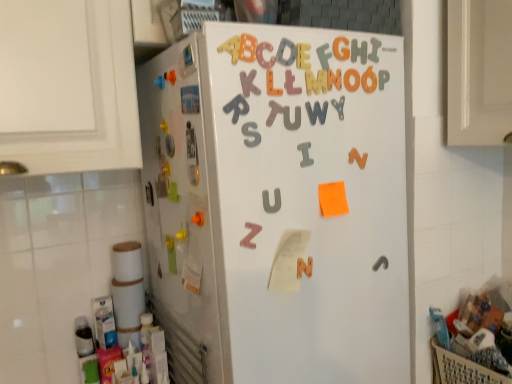
Question: Is rubberized plastic letter f at upper center, placed as the 7th letter when sorted from left to right, situated inside matte plastic letter t at center, which is the ninth letter from right to left, or outside?

Choices:
 (A) inside
 (B) outside

Answer: (B)

Question: Is point (326, 66) positioned closer to the camera than point (275, 112)?

Choices:
 (A) farther
 (B) closer

Answer: (A)

Question: Which object is the closest to the matte plastic letter t at center, which is the ninth letter from right to left?

Choices:
 (A) plastic beige basket at lower right
 (B) rubberized plastic letter f at upper center, placed as the 7th letter when sorted from left to right
 (C) orange matte letter n at upper center, which is the 8th letter from left to right
 (D) gray matte letter w at upper center, which is the 4th letter in right-to-left order
 (E) yellow foam letter e at upper center, which is the 4th letter from left to right

Answer: (D)

Question: Estimate the real-world distances between objects in this image. Which object is farther from the white matte refrigerator at center?

Choices:
 (A) orange matte letter n at upper center, which is the 8th letter from left to right
 (B) pink matte letter z at center
 (C) orange matte letter at upper center, which is counted as the 5th letter, starting from the right
 (D) rubberized plastic letter f at upper center, placed as the 7th letter when sorted from left to right
 (E) matte plastic letter at upper center, the seventh letter in the right-to-left sequence

Answer: (D)